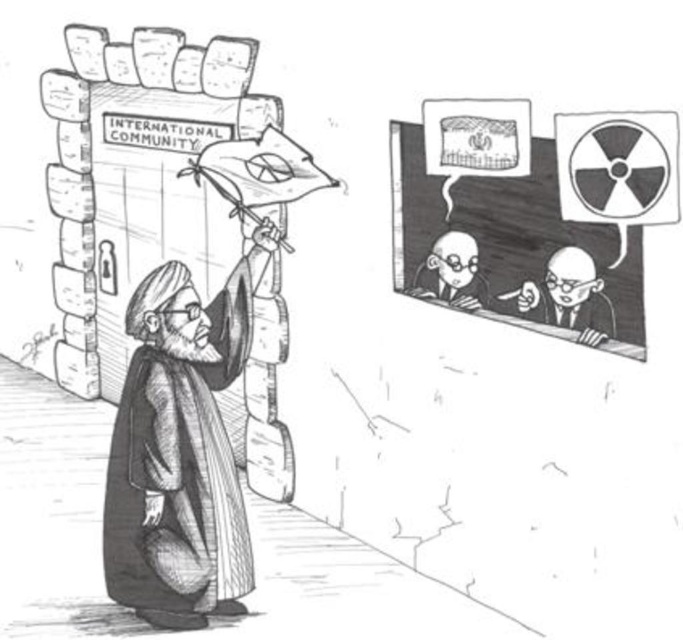
You are a security officer at the gate. You need to check if the distance between the smooth paper flag at upper center and the smooth skin bald man at center is within the 30 cm safety zone. Is the distance acceptable?

The smooth paper flag at upper center and the smooth skin bald man at center are 30.98 centimeters apart, which exceeds the 30 cm safety zone. The distance is not acceptable.